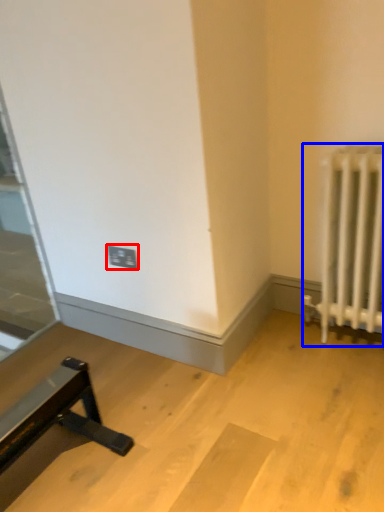
Question: Among these objects, which one is farthest to the camera, electric outlet (highlighted by a red box) or radiator (highlighted by a blue box)?

Choices:
 (A) electric outlet
 (B) radiator

Answer: (A)